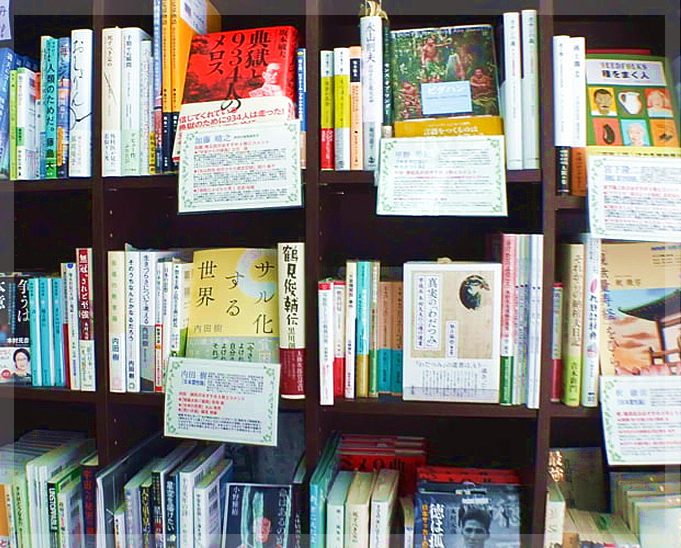
I want to click on wooden shelf under books, so click(x=57, y=181), click(x=153, y=185), click(x=353, y=178), click(x=570, y=202), click(x=46, y=393), click(x=127, y=393), click(x=380, y=408), click(x=575, y=408).